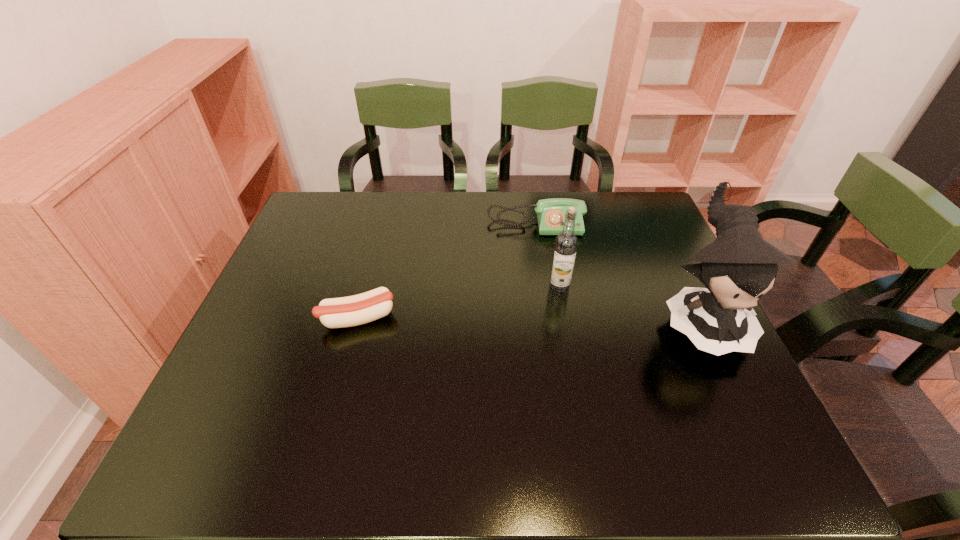
Locate an element on the screen. The width and height of the screenshot is (960, 540). vacant region located on the dial of the third tallest object is located at coordinates (546, 328).

Locate an element on the screen. free spot located 0.290m on the dial of the third tallest object is located at coordinates pos(543,307).

Find the location of a particular element. The width and height of the screenshot is (960, 540). free spot located 0.230m on the label of the vodka is located at coordinates (475, 326).

Identify the location of vacant space located 0.270m on the label of the vodka. Image resolution: width=960 pixels, height=540 pixels. (461, 333).

Where is `vacant space positioned on the label of the vodka`? This screenshot has width=960, height=540. vacant space positioned on the label of the vodka is located at coordinates (420, 352).

Identify the location of object located at the far edge. The width and height of the screenshot is (960, 540). (551, 212).

Image resolution: width=960 pixels, height=540 pixels. What are the coordinates of `object positioned at the right edge` in the screenshot? It's located at (739, 266).

You are a GUI agent. You are given a task and a screenshot of the screen. Output one action in this format:
    pyautogui.click(x=<x>, y=<y>)
    Task: Click on the vacant space at the far edge of the desktop
    
    Given the screenshot: What is the action you would take?
    pyautogui.click(x=445, y=202)

The image size is (960, 540). I want to click on free space at the near edge, so click(671, 418).

This screenshot has width=960, height=540. In the image, there is a desktop. What are the coordinates of `vacant space at the left edge` in the screenshot? It's located at (321, 264).